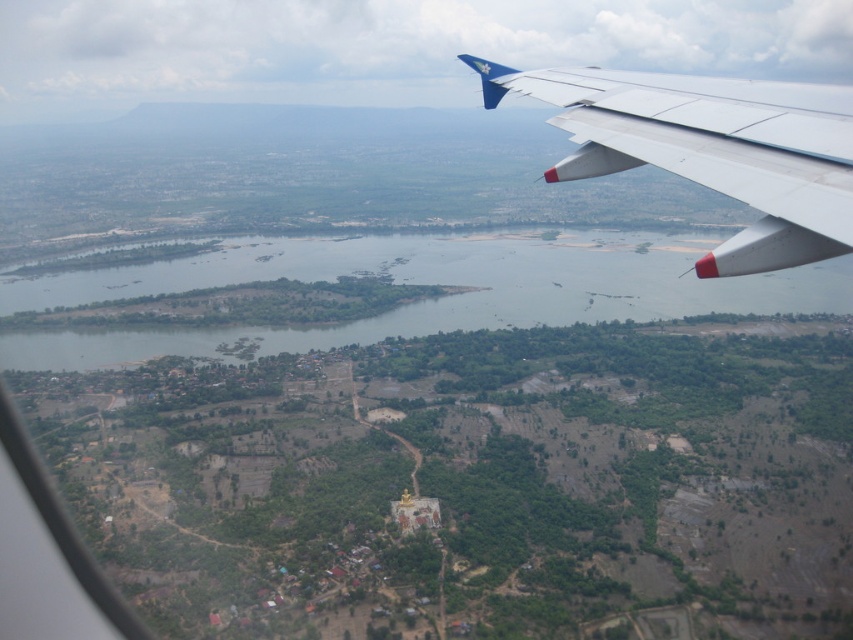
Consider the image. You are a passenger on an airplane and looking out the window. You see the green grassy land at center and the white metallic wing at upper right. Which object is closer to you?

The white metallic wing at upper right is closer to you because it is positioned in front of the green grassy land at center.

You are a passenger on an airplane and looking out the window. You see the green grassy land at center and the white metallic wing at upper right. Which object appears closer to you?

The white metallic wing at upper right appears closer because it is larger than the green grassy land at center, which is smaller and farther away.

You are a passenger on the airplane and looking out the window. You see the green grassy land at center and the white metallic wing at upper right. Which object is located lower in the scene?

The green grassy land at center is located below the white metallic wing at upper right, so it is lower in the scene.